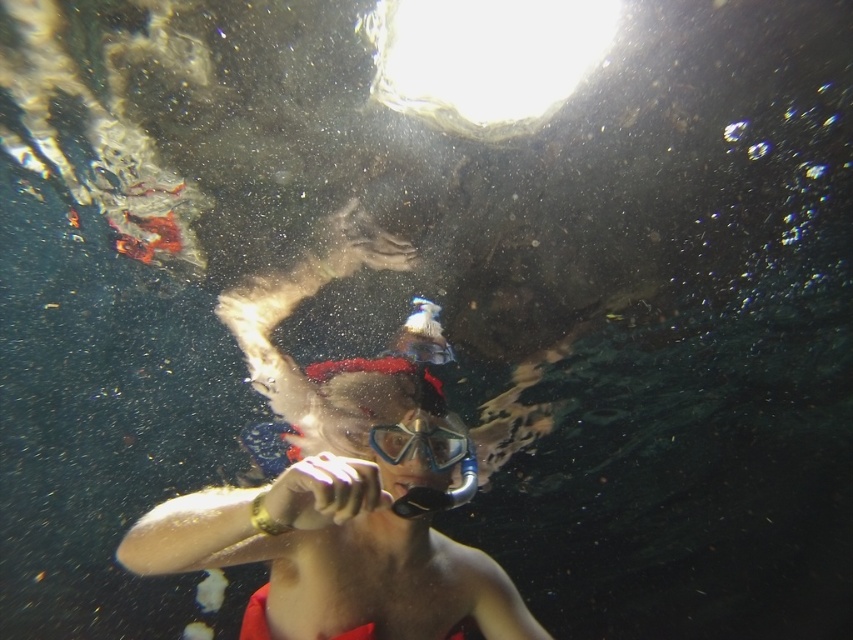
Does transparent water at top appear under transparent rubber goggles at center?

No.

The width and height of the screenshot is (853, 640). Describe the element at coordinates (486, 58) in the screenshot. I see `transparent water at top` at that location.

You are a GUI agent. You are given a task and a screenshot of the screen. Output one action in this format:
    pyautogui.click(x=<x>, y=<y>)
    Task: Click on the transparent water at top
    The height and width of the screenshot is (640, 853).
    Given the screenshot: What is the action you would take?
    pyautogui.click(x=486, y=58)